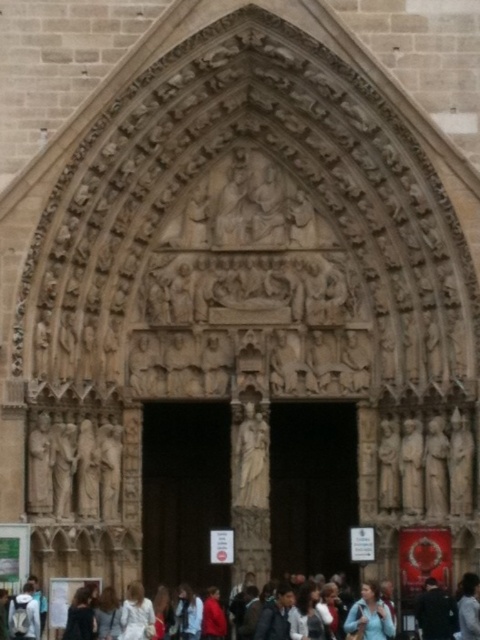
You are a photographer standing at the entrance of the cathedral and want to capture both the multicolored fabric crowd at lower center and the white fabric at lower center in a single shot. Based on their widths, can you fit both subjects into your camera frame without moving your position?

The multicolored fabric crowd at lower center might be wider than white fabric at lower center, so it is uncertain whether both can fit into the frame without knowing the exact width of the white fabric at lower center. Adjust your camera angle or zoom to accommodate both subjects.

You are standing at the entrance of the cathedral and see the dark wood door at center and the multicolored fabric crowd at lower center. Which object is located to the left of the other?

The dark wood door at center is positioned on the right side of multicolored fabric crowd at lower center, so the multicolored fabric crowd at lower center is to the left of the dark wood door at center.

You are an architect examining the cathedral entrance. You notice the multicolored fabric crowd at lower center and the white fabric at lower center. Which fabric is positioned higher in the image?

The multicolored fabric crowd at lower center is located above the white fabric at lower center, so it is positioned higher.